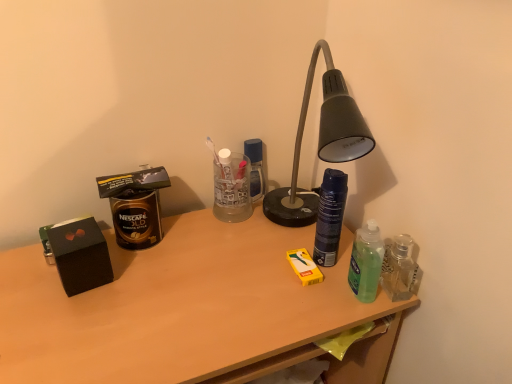
In order to click on gold matte canister at left in this screenshot , I will do `click(137, 219)`.

Image resolution: width=512 pixels, height=384 pixels. In order to click on green translucent bottle at right, which is the 2th bottle in left-to-right order in this screenshot , I will do `click(398, 268)`.

What do you see at coordinates (398, 268) in the screenshot? I see `green translucent bottle at right, which is the 2th bottle in left-to-right order` at bounding box center [398, 268].

This screenshot has height=384, width=512. Find the location of `wooden desk at center`. wooden desk at center is located at coordinates (189, 311).

Is green translucent bottle at right, which is the 2th bottle in left-to-right order, inside or outside of dark blue matte spray can at center, the second bottle from the right?

green translucent bottle at right, which is the 2th bottle in left-to-right order, cannot be found inside dark blue matte spray can at center, the second bottle from the right.

Considering the sizes of objects green translucent bottle at right, which is the 2th bottle in left-to-right order, and dark blue matte spray can at center, positioned as the 1th bottle in left-to-right order, in the image provided, who is shorter, green translucent bottle at right, which is the 2th bottle in left-to-right order, or dark blue matte spray can at center, positioned as the 1th bottle in left-to-right order,?

With less height is green translucent bottle at right, which is the 2th bottle in left-to-right order.

Looking at this image, considering the sizes of green translucent bottle at right, which is the 2th bottle in left-to-right order, and dark blue matte spray can at center, the second bottle from the right, in the image, is green translucent bottle at right, which is the 2th bottle in left-to-right order, bigger or smaller than dark blue matte spray can at center, the second bottle from the right,?

In the image, green translucent bottle at right, which is the 2th bottle in left-to-right order, appears to be smaller than dark blue matte spray can at center, the second bottle from the right.

Based on their positions, is green translucent bottle at right, which is the 2th bottle in left-to-right order, located to the left or right of dark blue matte spray can at center, positioned as the 1th bottle in left-to-right order?

In the image, green translucent bottle at right, which is the 2th bottle in left-to-right order, appears on the right side of dark blue matte spray can at center, positioned as the 1th bottle in left-to-right order.

Is green translucent bottle at right, which is the 2th bottle in left-to-right order, at the back of dark blue matte spray can at center, the second bottle from the right?

dark blue matte spray can at center, the second bottle from the right, is not turned away from green translucent bottle at right, which is the 2th bottle in left-to-right order.

Consider the image. From a real-world perspective, relative to green translucent bottle at right, which is the first bottle in right-to-left order, is dark blue matte spray can at center, positioned as the 1th bottle in left-to-right order, vertically above or below?

In terms of real-world spatial position, dark blue matte spray can at center, positioned as the 1th bottle in left-to-right order, is above green translucent bottle at right, which is the first bottle in right-to-left order.

Who is taller, dark blue matte spray can at center, the second bottle from the right, or green translucent bottle at right, which is the first bottle in right-to-left order?

Standing taller between the two is dark blue matte spray can at center, the second bottle from the right.

How many degrees apart are the facing directions of dark blue matte spray can at center, positioned as the 1th bottle in left-to-right order, and green translucent bottle at right, which is the 2th bottle in left-to-right order?

0.00441 degrees.

Is gold matte canister at left situated inside green translucent bottle at right, which is the first bottle in right-to-left order, or outside?

gold matte canister at left is spatially situated outside green translucent bottle at right, which is the first bottle in right-to-left order.

Between gold matte canister at left and green translucent bottle at right, which is the 2th bottle in left-to-right order, which one is positioned in front?

green translucent bottle at right, which is the 2th bottle in left-to-right order.

Is gold matte canister at left with green translucent bottle at right, which is the first bottle in right-to-left order?

They are not placed beside each other.

Does gold matte canister at left have a lesser height compared to green translucent bottle at right, which is the first bottle in right-to-left order?

No.

Between wooden desk at center and dark blue matte spray can at center, positioned as the 1th bottle in left-to-right order, which one is positioned in front?

Positioned in front is wooden desk at center.

Between wooden desk at center and dark blue matte spray can at center, the second bottle from the right, which one has less height?

dark blue matte spray can at center, the second bottle from the right.

From a real-world perspective, is wooden desk at center physically below dark blue matte spray can at center, positioned as the 1th bottle in left-to-right order?

Indeed, from a real-world perspective, wooden desk at center is positioned beneath dark blue matte spray can at center, positioned as the 1th bottle in left-to-right order.

Considering the positions of point (213, 273) and point (343, 209), is point (213, 273) closer or farther from the camera than point (343, 209)?

Point (213, 273) is positioned farther from the camera compared to point (343, 209).

Can you confirm if gold matte canister at left is thinner than dark blue matte spray can at center, positioned as the 1th bottle in left-to-right order?

In fact, gold matte canister at left might be wider than dark blue matte spray can at center, positioned as the 1th bottle in left-to-right order.

In the scene shown: Is gold matte canister at left at the left side of dark blue matte spray can at center, the second bottle from the right?

Indeed, gold matte canister at left is positioned on the left side of dark blue matte spray can at center, the second bottle from the right.

From a real-world perspective, is gold matte canister at left physically below dark blue matte spray can at center, the second bottle from the right?

Yes, from a real-world perspective, gold matte canister at left is under dark blue matte spray can at center, the second bottle from the right.

Is point (393, 262) closer or farther from the camera than point (285, 268)?

Point (393, 262).

Does green translucent bottle at right, which is the first bottle in right-to-left order, come behind wooden desk at center?

Yes, it is.

Would you consider green translucent bottle at right, which is the 2th bottle in left-to-right order, to be distant from wooden desk at center?

Actually, green translucent bottle at right, which is the 2th bottle in left-to-right order, and wooden desk at center are a little close together.

Locate an element on the screen. This screenshot has width=512, height=384. desk located on the left of green translucent bottle at right, which is the 2th bottle in left-to-right order is located at coordinates (189, 311).

Would you consider dark blue matte spray can at center, the second bottle from the right, to be distant from wooden desk at center?

They are positioned close to each other.

From the image's perspective, is dark blue matte spray can at center, positioned as the 1th bottle in left-to-right order, located beneath wooden desk at center?

No, from the image's perspective, dark blue matte spray can at center, positioned as the 1th bottle in left-to-right order, is not below wooden desk at center.

Does dark blue matte spray can at center, the second bottle from the right, have a greater width compared to wooden desk at center?

Incorrect, the width of dark blue matte spray can at center, the second bottle from the right, does not surpass that of wooden desk at center.

Can you confirm if dark blue matte spray can at center, positioned as the 1th bottle in left-to-right order, is bigger than wooden desk at center?

No, dark blue matte spray can at center, positioned as the 1th bottle in left-to-right order, is not bigger than wooden desk at center.

Where is `bottle that appears behind the green translucent bottle at right, which is the first bottle in right-to-left order`? This screenshot has height=384, width=512. bottle that appears behind the green translucent bottle at right, which is the first bottle in right-to-left order is located at coordinates (330, 217).

This screenshot has height=384, width=512. I want to click on bottle that is above the green translucent bottle at right, which is the first bottle in right-to-left order (from the image's perspective), so click(x=330, y=217).

When comparing their distances from gold matte canister at left, does green translucent bottle at right, which is the 2th bottle in left-to-right order, or dark blue matte spray can at center, positioned as the 1th bottle in left-to-right order, seem closer?

The object closer to gold matte canister at left is dark blue matte spray can at center, positioned as the 1th bottle in left-to-right order.

From the image, which object appears to be farther from gold matte canister at left, wooden desk at center or dark blue matte spray can at center, positioned as the 1th bottle in left-to-right order?

dark blue matte spray can at center, positioned as the 1th bottle in left-to-right order.

Based on the photo, from the image, which object appears to be farther from green translucent bottle at right, which is the first bottle in right-to-left order, dark blue matte spray can at center, the second bottle from the right, or wooden desk at center?

wooden desk at center is positioned further to the anchor green translucent bottle at right, which is the first bottle in right-to-left order.

From the image, which object appears to be nearer to wooden desk at center, dark blue matte spray can at center, the second bottle from the right, or green translucent bottle at right, which is the 2th bottle in left-to-right order?

dark blue matte spray can at center, the second bottle from the right, is positioned closer to the anchor wooden desk at center.

When comparing their distances from wooden desk at center, does green translucent bottle at right, which is the first bottle in right-to-left order, or gold matte canister at left seem closer?

gold matte canister at left.

Looking at the image, which one is located closer to gold matte canister at left, wooden desk at center or green translucent bottle at right, which is the first bottle in right-to-left order?

wooden desk at center lies closer to gold matte canister at left than the other object.

Considering their positions, is dark blue matte spray can at center, the second bottle from the right, positioned closer to green translucent bottle at right, which is the 2th bottle in left-to-right order, than gold matte canister at left?

Among the two, dark blue matte spray can at center, the second bottle from the right, is located nearer to green translucent bottle at right, which is the 2th bottle in left-to-right order.

Considering their positions, is wooden desk at center positioned closer to green translucent bottle at right, which is the 2th bottle in left-to-right order, than gold matte canister at left?

Among the two, wooden desk at center is located nearer to green translucent bottle at right, which is the 2th bottle in left-to-right order.

Where is `bottle situated between gold matte canister at left and green translucent bottle at right, which is the 2th bottle in left-to-right order, from left to right`? Image resolution: width=512 pixels, height=384 pixels. bottle situated between gold matte canister at left and green translucent bottle at right, which is the 2th bottle in left-to-right order, from left to right is located at coordinates (330, 217).

This screenshot has height=384, width=512. I want to click on desk situated between gold matte canister at left and green translucent bottle at right, which is the 2th bottle in left-to-right order, from left to right, so click(x=189, y=311).

Locate an element on the screen. Image resolution: width=512 pixels, height=384 pixels. bottle that lies between dark blue matte spray can at center, positioned as the 1th bottle in left-to-right order, and wooden desk at center from top to bottom is located at coordinates (398, 268).